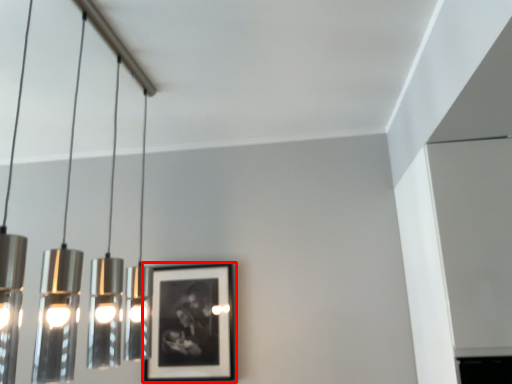
Question: From the image's perspective, what is the correct spatial relationship of picture frame (annotated by the red box) in relation to lamp?

Choices:
 (A) above
 (B) below

Answer: (B)